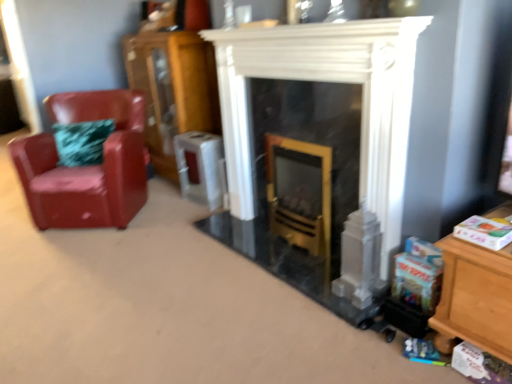
Image resolution: width=512 pixels, height=384 pixels. Describe the element at coordinates (318, 153) in the screenshot. I see `white marble fireplace at center` at that location.

This screenshot has width=512, height=384. I want to click on white marble fireplace at center, so click(x=318, y=153).

Image resolution: width=512 pixels, height=384 pixels. In order to click on glossy leather chair at left in this screenshot , I will do pos(87,166).

Does white marble fireplace at center have a greater width compared to glossy leather chair at left?

No, white marble fireplace at center is not wider than glossy leather chair at left.

From a real-world perspective, who is located lower, white marble fireplace at center or glossy leather chair at left?

glossy leather chair at left, from a real-world perspective.

How many degrees apart are the facing directions of white marble fireplace at center and glossy leather chair at left?

There is a 47-degree angle between the facing directions of white marble fireplace at center and glossy leather chair at left.

Is white marble fireplace at center completely or partially outside of glossy leather chair at left?

white marble fireplace at center lies outside glossy leather chair at left's area.

Can you confirm if wooden cabinet at left is taller than glossy leather chair at left?

Yes, wooden cabinet at left is taller than glossy leather chair at left.

Which is closer, [145,44] or [25,149]?

Point [145,44] is farther from the camera than point [25,149].

What's the angular difference between wooden cabinet at left and glossy leather chair at left's facing directions?

The facing directions of wooden cabinet at left and glossy leather chair at left are 49.1 degrees apart.

Are wooden cabinet at left and glossy leather chair at left making contact?

No, wooden cabinet at left is not with glossy leather chair at left.

Does point (54, 174) come in front of point (156, 59)?

Yes, point (54, 174) is closer to viewer.

Consider the image. From a real-world perspective, is glossy leather chair at left over wooden cabinet at left?

No, from a real-world perspective, glossy leather chair at left is not over wooden cabinet at left

In the scene shown: Is glossy leather chair at left to the right of wooden cabinet at left from the viewer's perspective?

No, glossy leather chair at left is not to the right of wooden cabinet at left.

Locate an element on the screen. This screenshot has width=512, height=384. dresser behind the white marble fireplace at center is located at coordinates (173, 89).

Measure the distance from white marble fireplace at center to wooden cabinet at left.

white marble fireplace at center is 3.80 feet from wooden cabinet at left.

Is white marble fireplace at center with wooden cabinet at left?

white marble fireplace at center and wooden cabinet at left are not in contact.

Considering the points (390, 113) and (162, 32), which point is behind, point (390, 113) or point (162, 32)?

The point (162, 32) is farther from the camera.

From the picture: Is glossy leather chair at left to the left or to the right of white marble fireplace at center in the image?

Clearly, glossy leather chair at left is on the left of white marble fireplace at center in the image.

At what (x,y) coordinates should I click in order to perform the action: click on fireplace on the right of glossy leather chair at left. Please return your answer as a coordinate pair (x, y). Looking at the image, I should click on (318, 153).

Measure the distance from glossy leather chair at left to white marble fireplace at center.

A distance of 3.68 feet exists between glossy leather chair at left and white marble fireplace at center.

From the image's perspective, which is below, glossy leather chair at left or white marble fireplace at center?

white marble fireplace at center.

From their relative heights in the image, would you say wooden cabinet at left is taller or shorter than white marble fireplace at center?

wooden cabinet at left is taller than white marble fireplace at center.

Can you confirm if wooden cabinet at left is bigger than white marble fireplace at center?

Yes, wooden cabinet at left is bigger than white marble fireplace at center.

Image resolution: width=512 pixels, height=384 pixels. What are the coordinates of `dresser located above the white marble fireplace at center (from the image's perspective)` in the screenshot? It's located at (173, 89).

Identify the location of chair that is above the white marble fireplace at center (from the image's perspective). (87, 166).

At what (x,y) coordinates should I click in order to perform the action: click on chair below the wooden cabinet at left (from the image's perspective). Please return your answer as a coordinate pair (x, y). This screenshot has width=512, height=384. Looking at the image, I should click on (87, 166).

When comparing their distances from glossy leather chair at left, does wooden cabinet at left or white marble fireplace at center seem closer?

Based on the image, wooden cabinet at left appears to be nearer to glossy leather chair at left.

When comparing their distances from white marble fireplace at center, does glossy leather chair at left or wooden cabinet at left seem further?

wooden cabinet at left is positioned further to the anchor white marble fireplace at center.

From the image, which object appears to be nearer to wooden cabinet at left, white marble fireplace at center or glossy leather chair at left?

Among the two, glossy leather chair at left is located nearer to wooden cabinet at left.

From the image, which object appears to be nearer to glossy leather chair at left, white marble fireplace at center or wooden cabinet at left?

Among the two, wooden cabinet at left is located nearer to glossy leather chair at left.

Which object lies nearer to the anchor point wooden cabinet at left, glossy leather chair at left or white marble fireplace at center?

glossy leather chair at left is closer to wooden cabinet at left.

When comparing their distances from white marble fireplace at center, does wooden cabinet at left or glossy leather chair at left seem further?

wooden cabinet at left.

The height and width of the screenshot is (384, 512). Find the location of `dresser located between glossy leather chair at left and white marble fireplace at center in the left-right direction`. dresser located between glossy leather chair at left and white marble fireplace at center in the left-right direction is located at coordinates (173, 89).